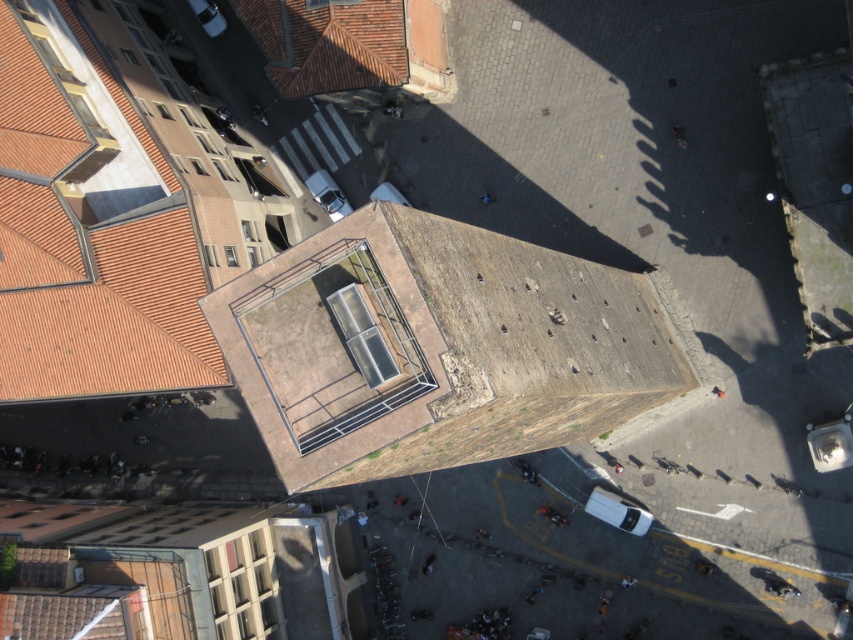
Question: Among these objects, which one is nearest to the camera?

Choices:
 (A) brown textured roof at center
 (B) terracotta tiles at upper left

Answer: (A)

Question: Can you confirm if brown textured roof at center is bigger than terracotta tiles at upper left?

Choices:
 (A) no
 (B) yes

Answer: (B)

Question: Is brown textured roof at center behind terracotta tiles at upper left?

Choices:
 (A) yes
 (B) no

Answer: (B)

Question: Which of the following is the farthest from the observer?

Choices:
 (A) (270, 52)
 (B) (277, 292)

Answer: (A)

Question: In this image, where is brown textured roof at center located relative to terracotta tiles at upper left?

Choices:
 (A) above
 (B) below

Answer: (B)